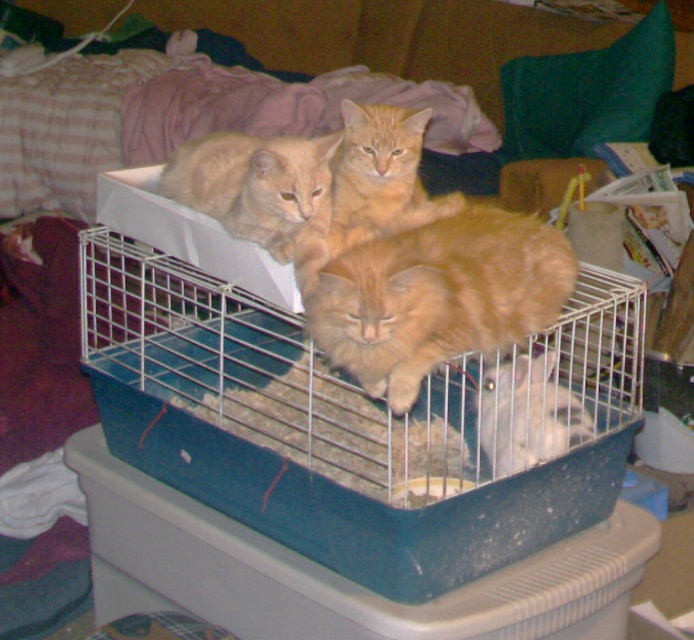
Question: Which object is positioned closest to the orange fur cat at center?

Choices:
 (A) blue plastic bird cage at center
 (B) fluffy orange cat at center
 (C) orange fur cat at upper center

Answer: (C)

Question: Observing the image, what is the correct spatial positioning of fluffy orange cat at center in reference to orange fur cat at upper center?

Choices:
 (A) below
 (B) above

Answer: (A)

Question: Among these points, which one is farthest from the camera?

Choices:
 (A) (298, 202)
 (B) (264, 428)

Answer: (B)

Question: Which object is the farthest from the orange fur cat at upper center?

Choices:
 (A) fluffy orange cat at center
 (B) blue plastic bird cage at center

Answer: (B)

Question: Does blue plastic bird cage at center appear on the left side of orange fur cat at center?

Choices:
 (A) yes
 (B) no

Answer: (B)

Question: Where is blue plastic bird cage at center located in relation to orange fur cat at center in the image?

Choices:
 (A) above
 (B) below

Answer: (B)